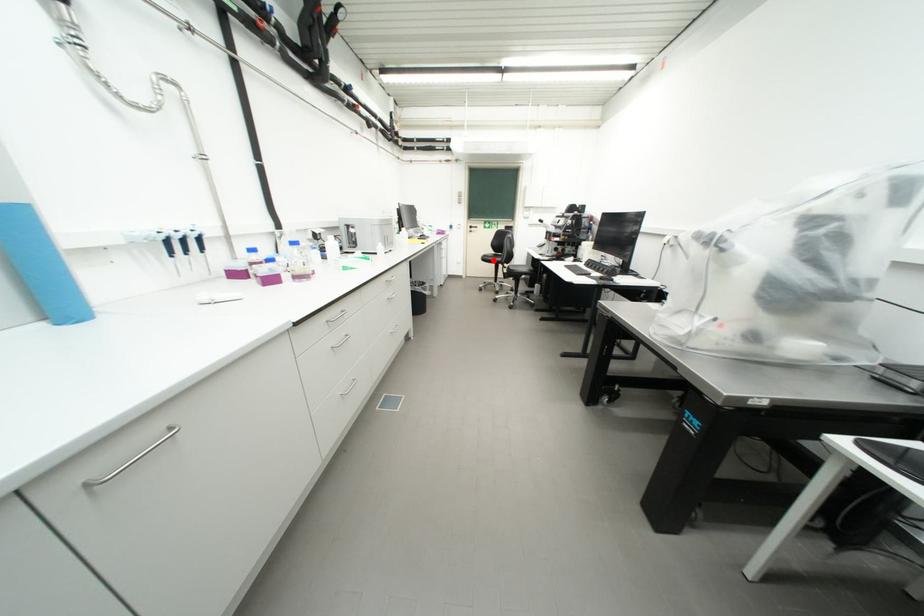
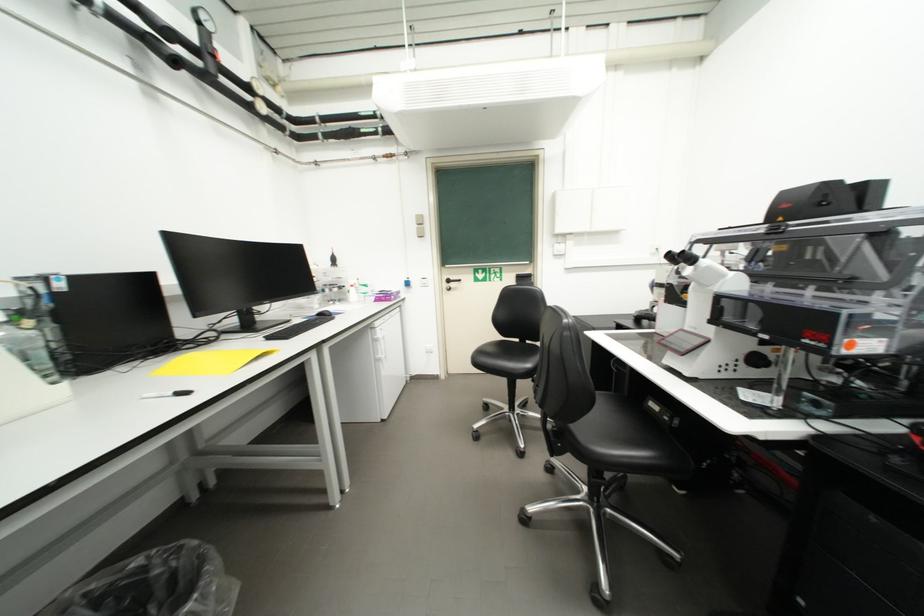
The point at the highlighted location is marked in the first image. Where is the corresponding point in the second image?

(490, 362)